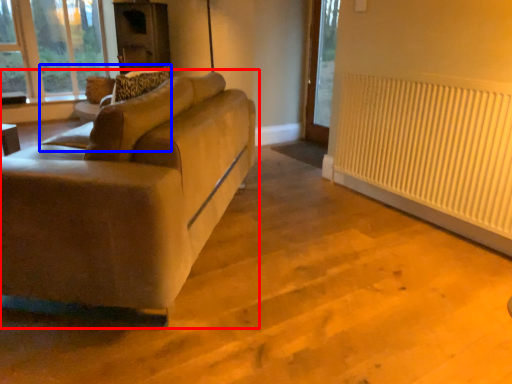
Question: Which of the following is the farthest to the observer, studio couch (highlighted by a red box) or swivel chair (highlighted by a blue box)?

Choices:
 (A) studio couch
 (B) swivel chair

Answer: (B)